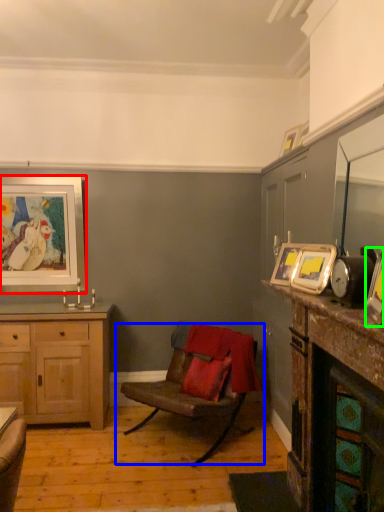
Question: Which is farther away from picture frame (highlighted by a red box)? chair (highlighted by a blue box) or picture frame (highlighted by a green box)?

Choices:
 (A) chair
 (B) picture frame

Answer: (B)